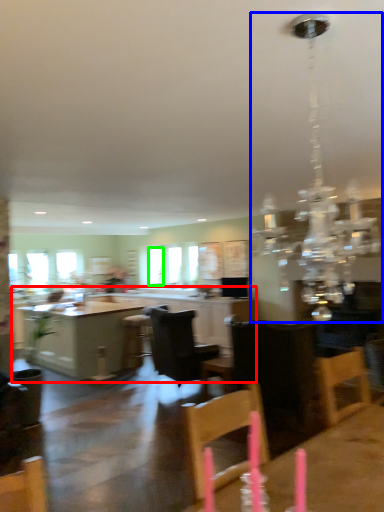
Question: Which object is positioned farthest from cabinetry (highlighted by a red box)? Select from light fixture (highlighted by a blue box) and window (highlighted by a green box).

Choices:
 (A) light fixture
 (B) window

Answer: (B)